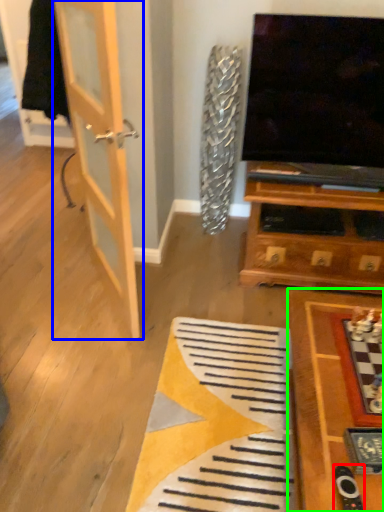
Question: Which object is the farthest from remote (highlighted by a red box)? Choose among these: door (highlighted by a blue box) or table (highlighted by a green box).

Choices:
 (A) door
 (B) table

Answer: (A)